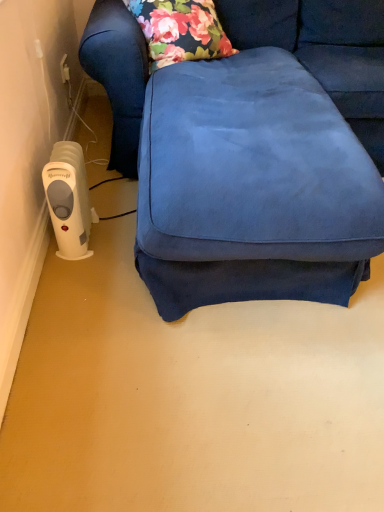
Question: Can you confirm if suede blue couch at center is taller than white plastic heater at lower left?

Choices:
 (A) no
 (B) yes

Answer: (B)

Question: Does suede blue couch at center have a smaller size compared to white plastic heater at lower left?

Choices:
 (A) yes
 (B) no

Answer: (B)

Question: Considering the relative positions of suede blue couch at center and white plastic heater at lower left in the image provided, is suede blue couch at center to the left of white plastic heater at lower left from the viewer's perspective?

Choices:
 (A) yes
 (B) no

Answer: (B)

Question: Is suede blue couch at center outside of white plastic heater at lower left?

Choices:
 (A) yes
 (B) no

Answer: (A)

Question: Considering the relative sizes of suede blue couch at center and white plastic heater at lower left in the image provided, is suede blue couch at center wider than white plastic heater at lower left?

Choices:
 (A) no
 (B) yes

Answer: (B)

Question: Can you confirm if suede blue couch at center is shorter than white plastic heater at lower left?

Choices:
 (A) no
 (B) yes

Answer: (A)

Question: Can you confirm if white plastic heater at lower left is bigger than suede blue couch at center?

Choices:
 (A) yes
 (B) no

Answer: (B)

Question: Considering the relative sizes of white plastic heater at lower left and suede blue couch at center in the image provided, is white plastic heater at lower left wider than suede blue couch at center?

Choices:
 (A) yes
 (B) no

Answer: (B)

Question: Considering the relative positions of white plastic heater at lower left and suede blue couch at center in the image provided, is white plastic heater at lower left to the right of suede blue couch at center from the viewer's perspective?

Choices:
 (A) no
 (B) yes

Answer: (A)

Question: Can you confirm if white plastic heater at lower left is taller than suede blue couch at center?

Choices:
 (A) yes
 (B) no

Answer: (B)

Question: Is white plastic heater at lower left further to camera compared to suede blue couch at center?

Choices:
 (A) no
 (B) yes

Answer: (B)

Question: Is white plastic heater at lower left smaller than suede blue couch at center?

Choices:
 (A) no
 (B) yes

Answer: (B)

Question: From the image's perspective, is suede blue couch at center above or below white plastic heater at lower left?

Choices:
 (A) above
 (B) below

Answer: (A)